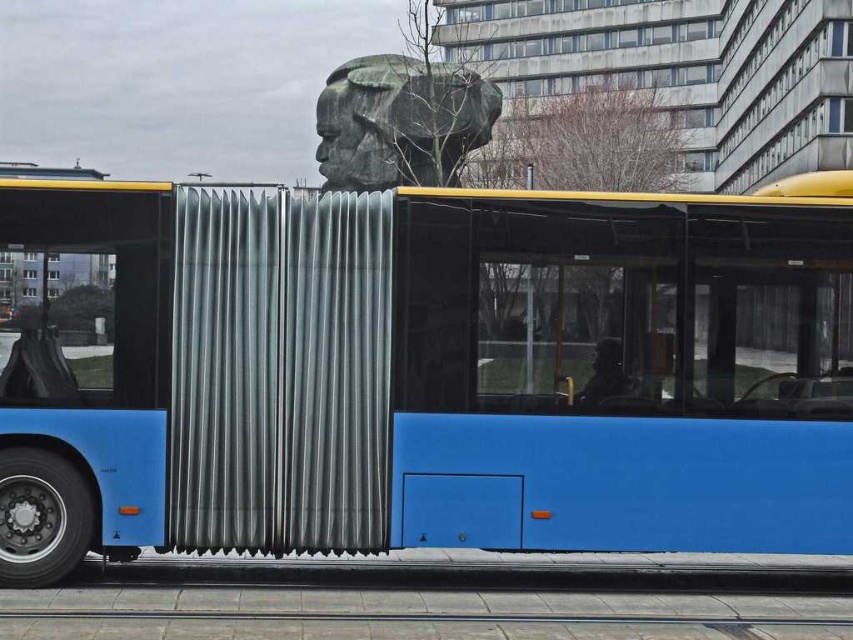
You are a photographer trying to capture both the blue matte bus at center and the green patina stone head at upper center in the same frame. Given their relative sizes, which object will appear smaller in your photo?

The blue matte bus at center will appear smaller in the photo because it is shorter than the green patina stone head at upper center.

You are a photographer trying to capture both the blue matte bus at center and the green patina stone head at upper center in a single shot. Based on their positions, which object should you adjust your camera angle to focus on first to ensure both are in frame?

The blue matte bus at center is to the right of the green patina stone head at upper center. To capture both in a single shot, adjust your camera angle to focus on the green patina stone head at upper center first, as it is positioned to the left, allowing the bus to naturally fall into the frame to its right.

You are a photographer planning to take a photo of the blue matte bus at center and the green patina stone head at upper center. Which object should you focus on first if you want to capture both in a single frame without moving the camera?

You should focus on the blue matte bus at center first because it is smaller than the green patina stone head at upper center, allowing you to adjust the framing to include both objects.